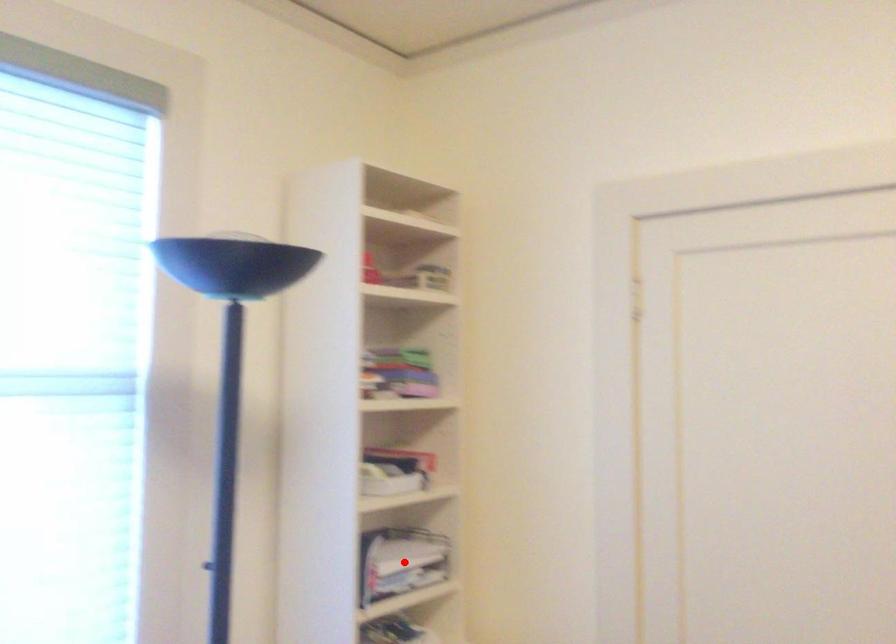
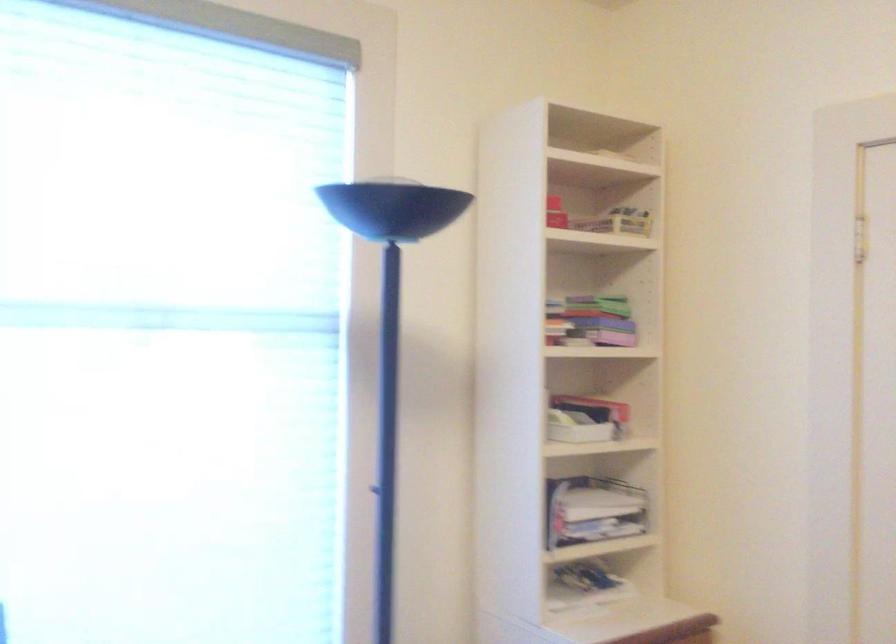
Find the pixel in the second image that matches the highlighted location in the first image.

(592, 509)